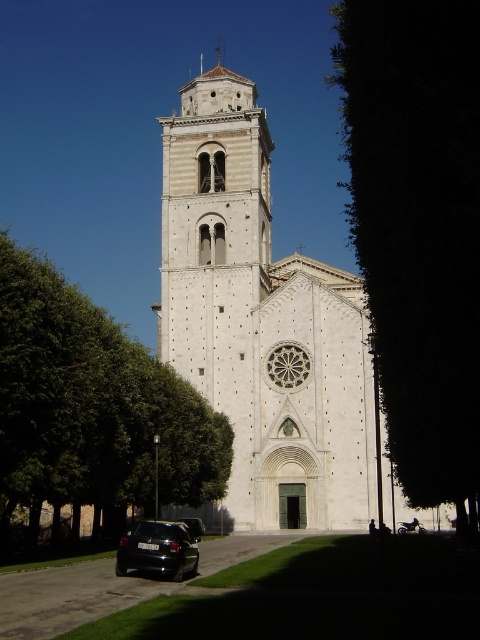
You are a photographer planning to capture the entire church and its surroundings. Given that the green leafy tree at left and the black matte car at lower left are in your frame, which object would require more space horizontally in your composition?

The green leafy tree at left requires more horizontal space in the composition because its width surpasses that of the black matte car at lower left.

You are standing at the entrance of the church and see two points marked on the ground in front of you. The first point is labeled as point (195, 465) and the second is point (202, 529). Which point is closer to you?

Point (195, 465) is closer to you because it is in front of point (202, 529).

You are standing in front of the historic church and want to take a photo that includes both the green leafy tree at left and the bell tower. Based on their distances from you, can you fit both in the frame without moving closer or farther?

The green leafy tree at left is 55.40 meters away from the camera. Since the bell tower is part of the church which is presumably closer than the tree, you can fit both in the frame without moving as they are at different distances but within a reasonable range for a camera lens.